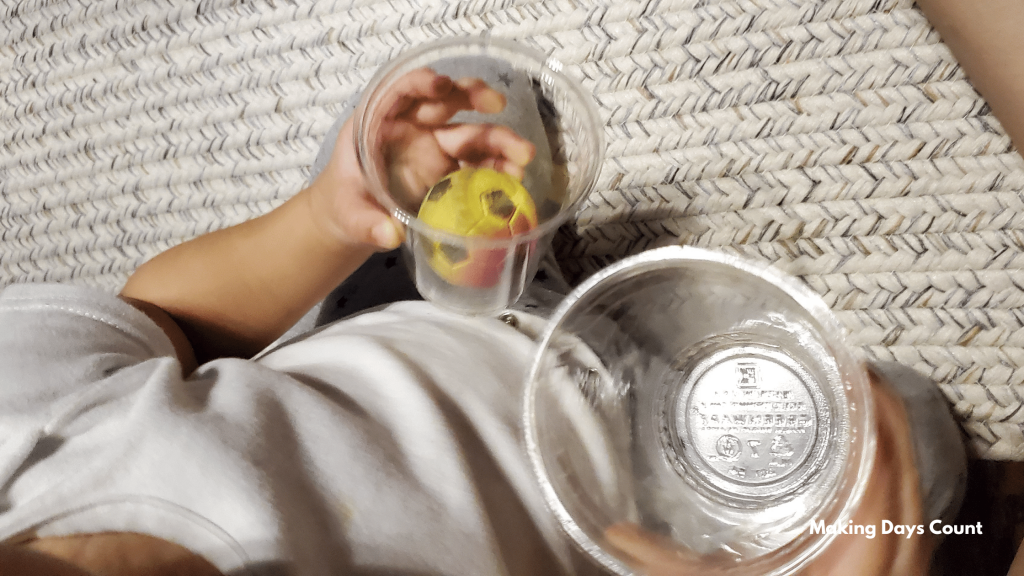
The width and height of the screenshot is (1024, 576). I want to click on one empty clear cup in right hand, so click(602, 313).